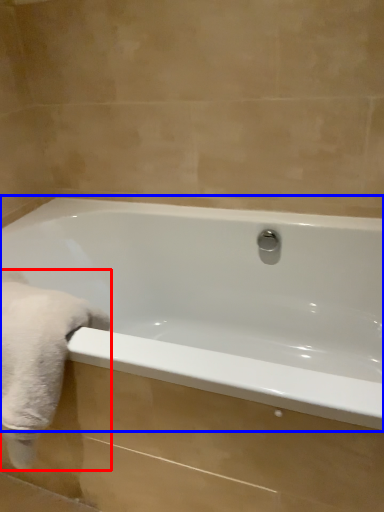
Question: Which point is closer to the camera, bath towel (highlighted by a red box) or bathtub (highlighted by a blue box)?

Choices:
 (A) bath towel
 (B) bathtub

Answer: (B)